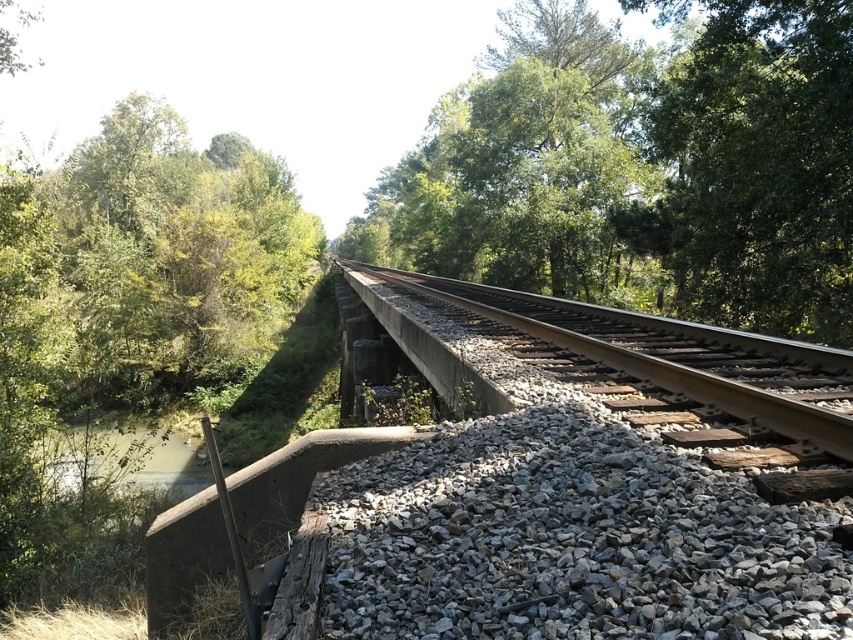
You are standing at the starting point of the railway track and looking towards the distant bridge. There are two points marked on the tracks, point 1 at coordinates point (821, 147) and point 2 at coordinates point (532, 314). Which point is closer to you?

Point (821, 147) is closer to the camera than point (532, 314), so the point closer to you is point (821, 147).

You are standing at the center of the railway tracks and looking towards the distant bridge. Which direction should you look to see the green leafy tree at upper right?

The green leafy tree at upper right is located at point 0.261 on the x and 0.885 on the y axis, so you should look to your upper right direction to see it.

You are a maintenance worker checking the railway tracks. You notice the gray gravel at center and the smooth concrete track at center. Which one is positioned lower in the scene?

The gray gravel at center is located below the smooth concrete track at center, so it is positioned lower in the scene.